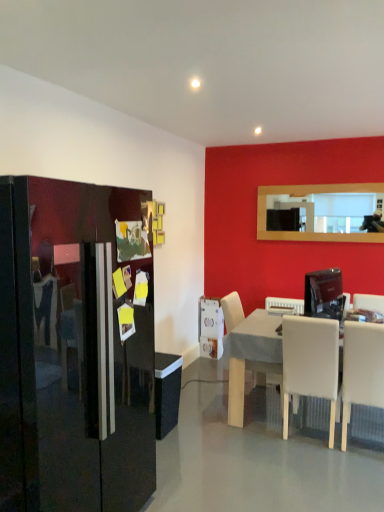
Question: Is white leather chair at lower right, which is the 3th chair from left to right, taller or shorter than white plastic toaster at center, which is the 2th appliance in front-to-back order?

Choices:
 (A) short
 (B) tall

Answer: (B)

Question: Is white leather chair at lower right, which is the 3th chair from left to right, in front of or behind white plastic toaster at center, which is the second appliance in left-to-right order, in the image?

Choices:
 (A) front
 (B) behind

Answer: (A)

Question: Estimate the real-world distances between objects in this image. Which object is closer to the white glossy toaster at lower center, positioned as the third appliance in front-to-back order?

Choices:
 (A) glossy black refrigerator at left
 (B) white leather chair at lower right, arranged as the 1th chair when viewed from the right
 (C) white leather chair at center, which is the 1th chair in left-to-right order
 (D) satin black monitor at right, which is the 3th appliance from back to front
 (E) white matte chair at lower right, the 2th chair viewed from the left

Answer: (C)

Question: Based on their relative distances, which object is farther from the white matte chair at lower right, the 2th chair viewed from the left?

Choices:
 (A) white leather chair at center, which is the 1th chair in left-to-right order
 (B) glossy black refrigerator at left
 (C) white leather chair at lower right, which is the 3th chair from left to right
 (D) white glossy toaster at lower center, positioned as the third appliance in front-to-back order
 (E) white plastic toaster at center, which is the second appliance in left-to-right order

Answer: (D)